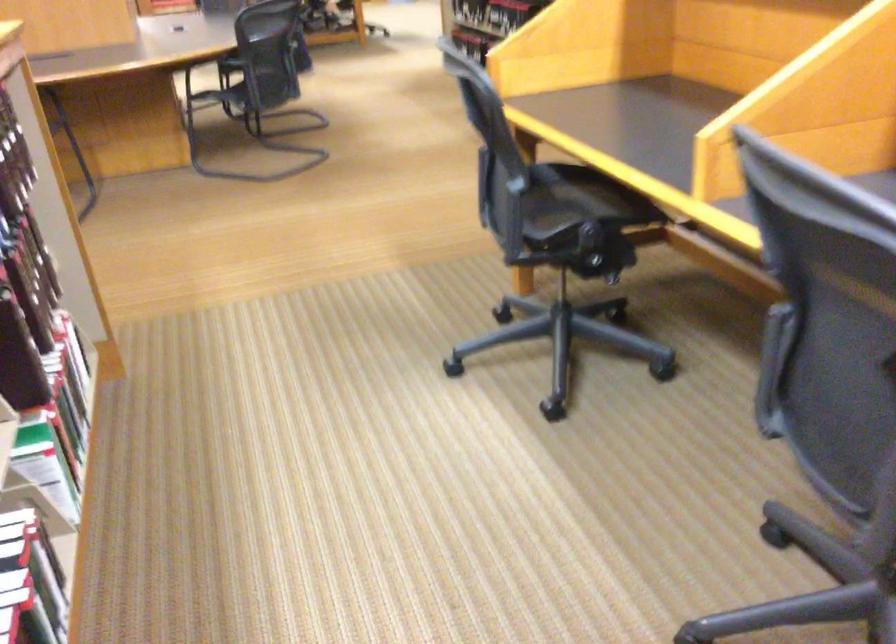
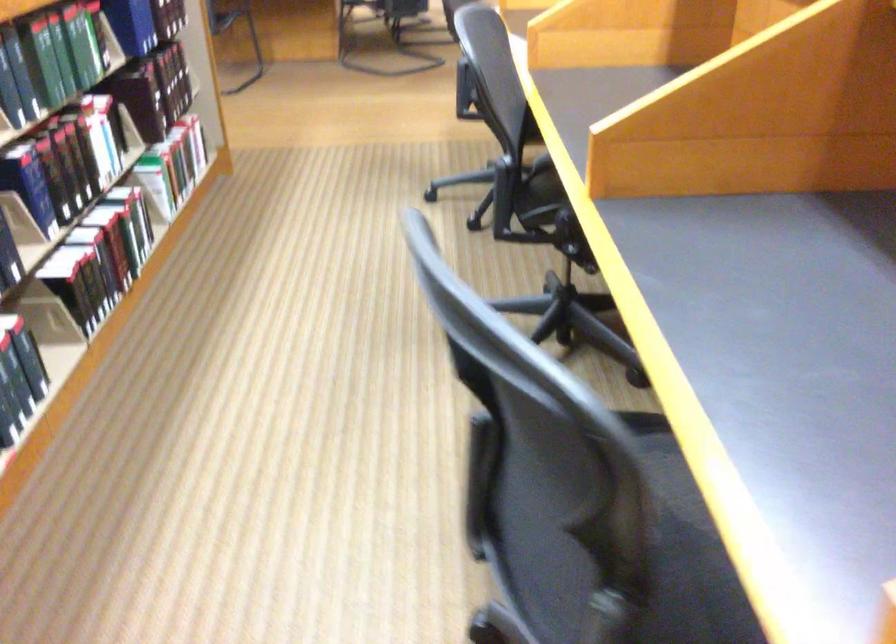
In a continuous first-person perspective shot, in which direction is the camera moving?

The movement direction of the cameraman is right, backward.